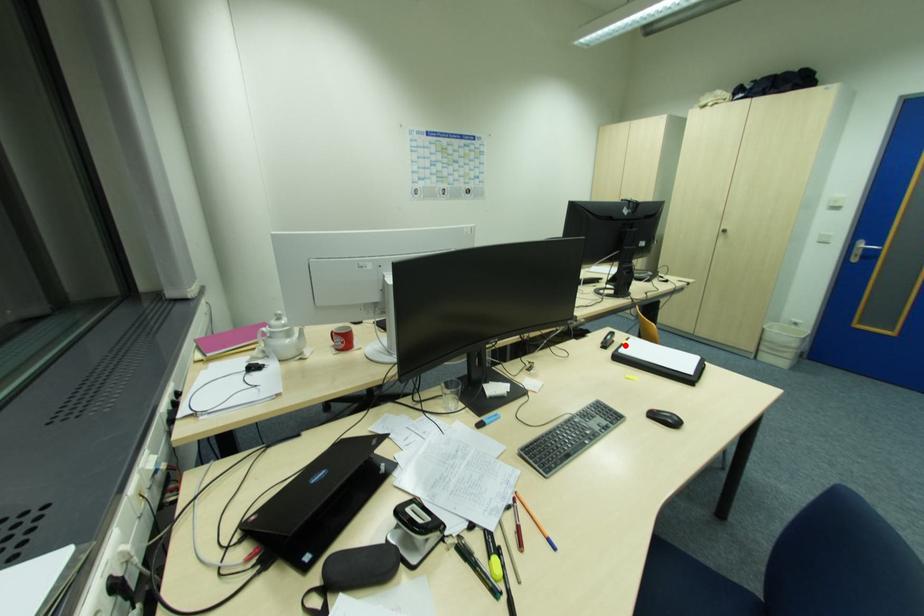
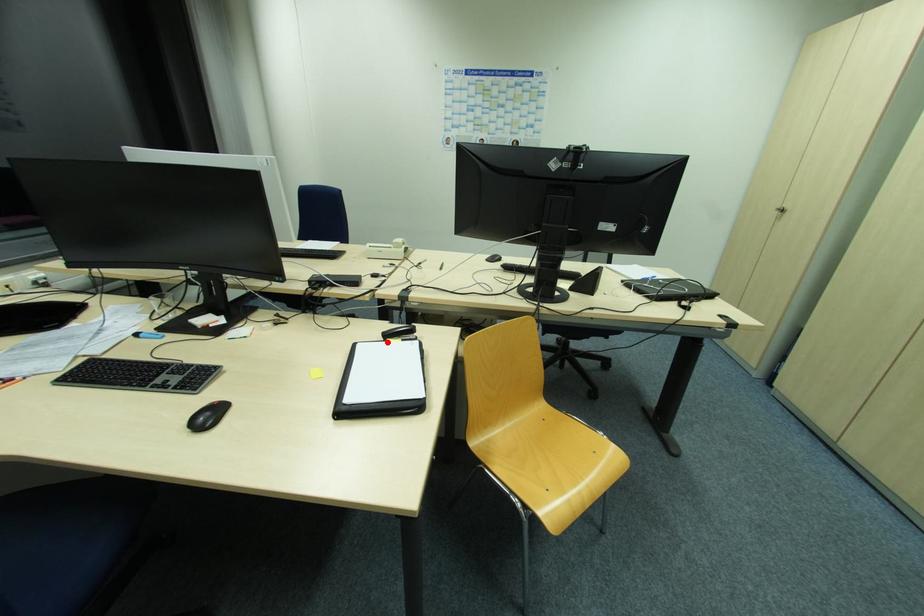
Looking at this image, I am providing you with two images of the same scene from different viewpoints. A red point is marked on the first image and another point is marked on the second image. Is the red point in image1 aligned with the point shown in image2?

Yes